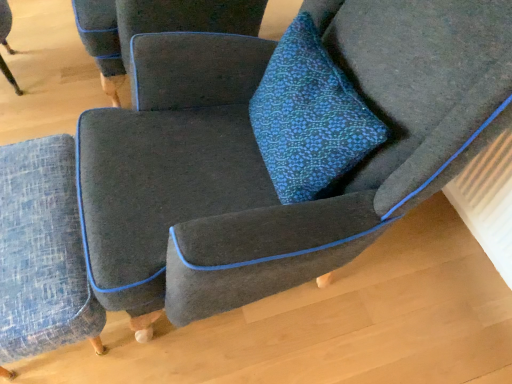
Question: Is textured gray armchair at center, the 1th chair when ordered from top to bottom, shorter than blue textured ottoman at lower left, which is counted as the 1th chair, starting from the bottom?

Choices:
 (A) no
 (B) yes

Answer: (A)

Question: From a real-world perspective, is textured gray armchair at center, which appears as the 2th chair when ordered from the bottom, below blue textured ottoman at lower left, which is counted as the 1th chair, starting from the bottom?

Choices:
 (A) no
 (B) yes

Answer: (A)

Question: Considering the relative sizes of textured gray armchair at center, which appears as the 2th chair when ordered from the bottom, and blue textured ottoman at lower left, which is counted as the 1th chair, starting from the bottom, in the image provided, is textured gray armchair at center, which appears as the 2th chair when ordered from the bottom, wider than blue textured ottoman at lower left, which is counted as the 1th chair, starting from the bottom,?

Choices:
 (A) no
 (B) yes

Answer: (B)

Question: Can you confirm if textured gray armchair at center, which appears as the 2th chair when ordered from the bottom, is bigger than blue textured ottoman at lower left, the second chair positioned from the top?

Choices:
 (A) no
 (B) yes

Answer: (B)

Question: Is textured gray armchair at center, which appears as the 2th chair when ordered from the bottom, oriented towards blue textured ottoman at lower left, the second chair positioned from the top?

Choices:
 (A) yes
 (B) no

Answer: (B)

Question: Considering the relative positions of textured gray armchair at center, the 1th chair when ordered from top to bottom, and blue textured ottoman at lower left, the second chair positioned from the top, in the image provided, is textured gray armchair at center, the 1th chair when ordered from top to bottom, to the right of blue textured ottoman at lower left, the second chair positioned from the top, from the viewer's perspective?

Choices:
 (A) no
 (B) yes

Answer: (B)

Question: Would you consider blue textured cushion at center to be distant from textured gray armchair at center, the 1th chair when ordered from top to bottom?

Choices:
 (A) yes
 (B) no

Answer: (B)

Question: Can you confirm if blue textured cushion at center is bigger than textured gray armchair at center, which appears as the 2th chair when ordered from the bottom?

Choices:
 (A) no
 (B) yes

Answer: (A)

Question: Considering the relative sizes of blue textured cushion at center and textured gray armchair at center, which appears as the 2th chair when ordered from the bottom, in the image provided, is blue textured cushion at center taller than textured gray armchair at center, which appears as the 2th chair when ordered from the bottom,?

Choices:
 (A) no
 (B) yes

Answer: (A)

Question: From a real-world perspective, is blue textured cushion at center over textured gray armchair at center, which appears as the 2th chair when ordered from the bottom?

Choices:
 (A) yes
 (B) no

Answer: (A)

Question: Is blue textured cushion at center behind textured gray armchair at center, which appears as the 2th chair when ordered from the bottom?

Choices:
 (A) yes
 (B) no

Answer: (B)

Question: From the image's perspective, would you say blue textured cushion at center is shown under textured gray armchair at center, the 1th chair when ordered from top to bottom?

Choices:
 (A) yes
 (B) no

Answer: (A)

Question: Does blue textured cushion at center appear on the left side of blue textured ottoman at lower left, the second chair positioned from the top?

Choices:
 (A) yes
 (B) no

Answer: (B)